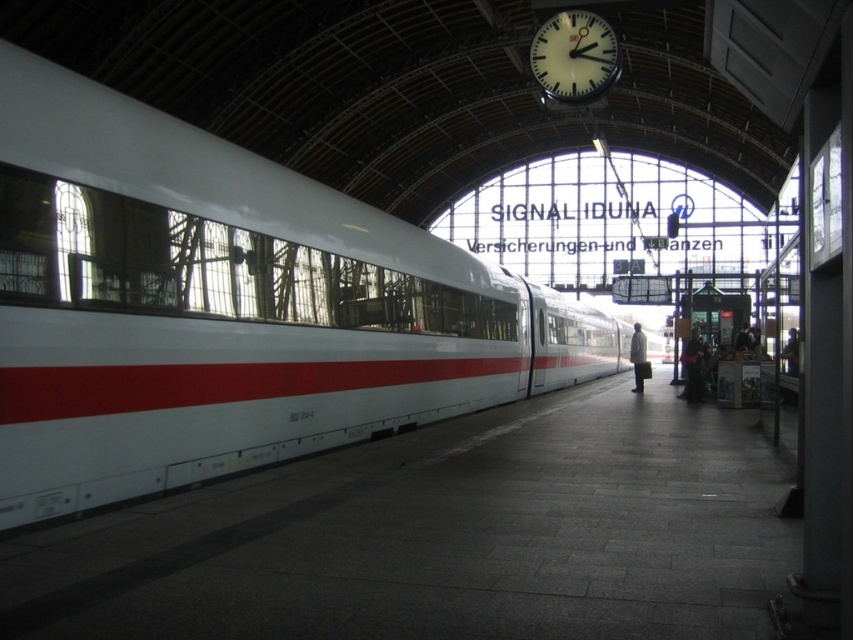
Who is positioned more to the left, white glossy train at center or white matte coat at center?

Positioned to the left is white glossy train at center.

Between point (117, 108) and point (642, 388), which one is positioned in front?

Point (117, 108) is more forward.

Where is `white glossy train at center`? This screenshot has width=853, height=640. white glossy train at center is located at coordinates (227, 307).

Who is more forward, (685, 353) or (642, 348)?

Positioned in front is point (685, 353).

Between dark blue fabric coat at right and white matte coat at center, which one appears on the right side from the viewer's perspective?

From the viewer's perspective, white matte coat at center appears more on the right side.

Where is `dark blue fabric coat at right`? dark blue fabric coat at right is located at coordinates (693, 365).

The image size is (853, 640). I want to click on white glossy clock at upper center, so click(x=573, y=56).

At what (x,y) coordinates should I click in order to perform the action: click on white glossy clock at upper center. Please return your answer as a coordinate pair (x, y). This screenshot has width=853, height=640. Looking at the image, I should click on (573, 56).